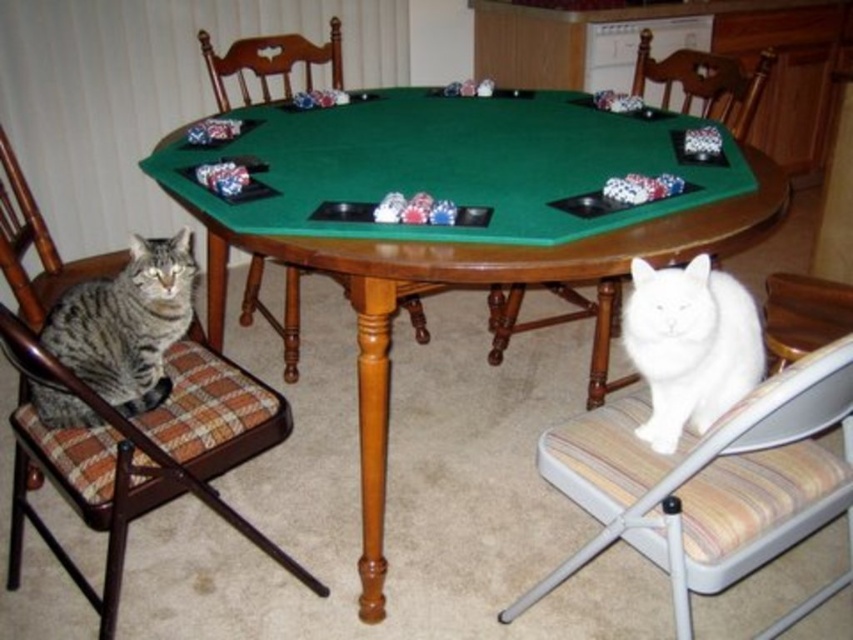
Question: Does green felt table at center appear under tabby fur cat at left?

Choices:
 (A) yes
 (B) no

Answer: (B)

Question: Which of the following is the farthest from the observer?

Choices:
 (A) white fabric chair at lower right
 (B) white fluffy cat at lower right
 (C) brown plaid cushioned chair at left

Answer: (A)

Question: Is striped fabric chair at lower right bigger than white fluffy cat at lower right?

Choices:
 (A) no
 (B) yes

Answer: (B)

Question: Which object is farther from the camera taking this photo?

Choices:
 (A) striped fabric chair at lower right
 (B) tabby fur cat at left

Answer: (B)

Question: Does striped fabric chair at lower right lie behind tabby fur cat at left?

Choices:
 (A) no
 (B) yes

Answer: (A)

Question: Which of the following is the farthest from the observer?

Choices:
 (A) (573, 122)
 (B) (51, 339)
 (C) (548, 262)
 (D) (9, 332)

Answer: (A)